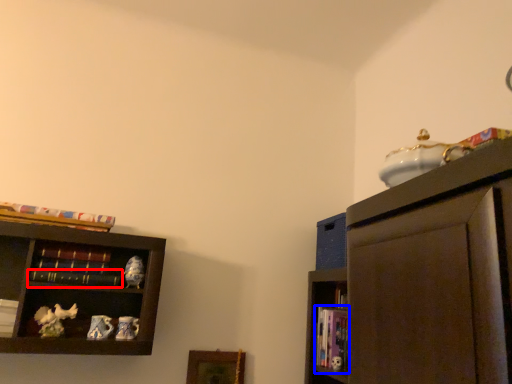
Question: Among these objects, which one is nearest to the camera, book (highlighted by a red box) or book (highlighted by a blue box)?

Choices:
 (A) book
 (B) book

Answer: (A)